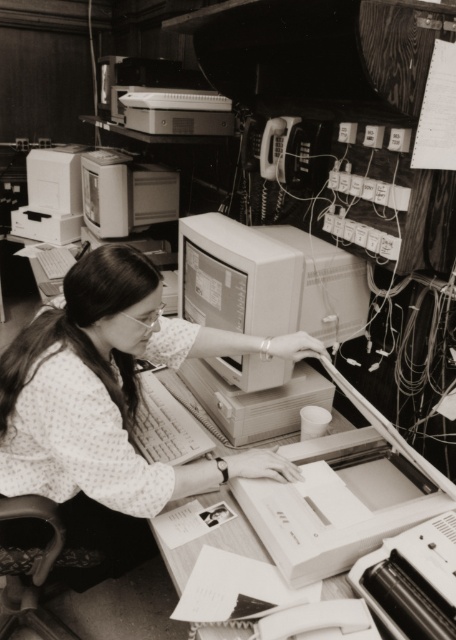
In the scene shown: Is polka dot fabric shirt at center smaller than matte gray monitor at center?

Incorrect, polka dot fabric shirt at center is not smaller in size than matte gray monitor at center.

Where is `polka dot fabric shirt at center`? The image size is (456, 640). polka dot fabric shirt at center is located at coordinates (110, 406).

Image resolution: width=456 pixels, height=640 pixels. What are the coordinates of `polka dot fabric shirt at center` in the screenshot? It's located at (110, 406).

Can you confirm if polka dot fabric shirt at center is positioned to the right of smooth white table at center?

In fact, polka dot fabric shirt at center is to the left of smooth white table at center.

Can you confirm if polka dot fabric shirt at center is taller than smooth white table at center?

Yes, polka dot fabric shirt at center is taller than smooth white table at center.

Is point (177, 497) less distant than point (321, 556)?

That is False.

The image size is (456, 640). What are the coordinates of `polka dot fabric shirt at center` in the screenshot? It's located at (110, 406).

Can you confirm if matte gray monitor at center is wider than smooth white table at center?

Incorrect, matte gray monitor at center's width does not surpass smooth white table at center's.

Between point (186, 284) and point (419, 458), which one is positioned behind?

The point (186, 284) is behind.

Find the location of `matte gray monitor at center`. matte gray monitor at center is located at coordinates (268, 280).